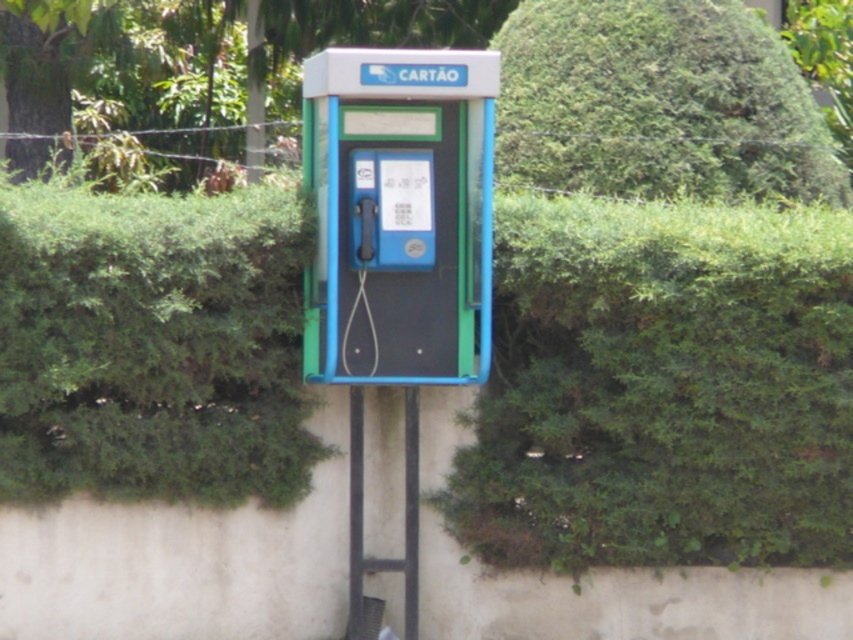
Can you confirm if blue plastic phone box at center is taller than green leafy hedge at upper center?

Correct, blue plastic phone box at center is much taller as green leafy hedge at upper center.

Does point (486, 67) lie behind point (519, 84)?

No, (486, 67) is in front of (519, 84).

Is point (450, 208) closer to viewer compared to point (732, 106)?

Yes, it is.

Where is `blue plastic phone box at center`? blue plastic phone box at center is located at coordinates (399, 214).